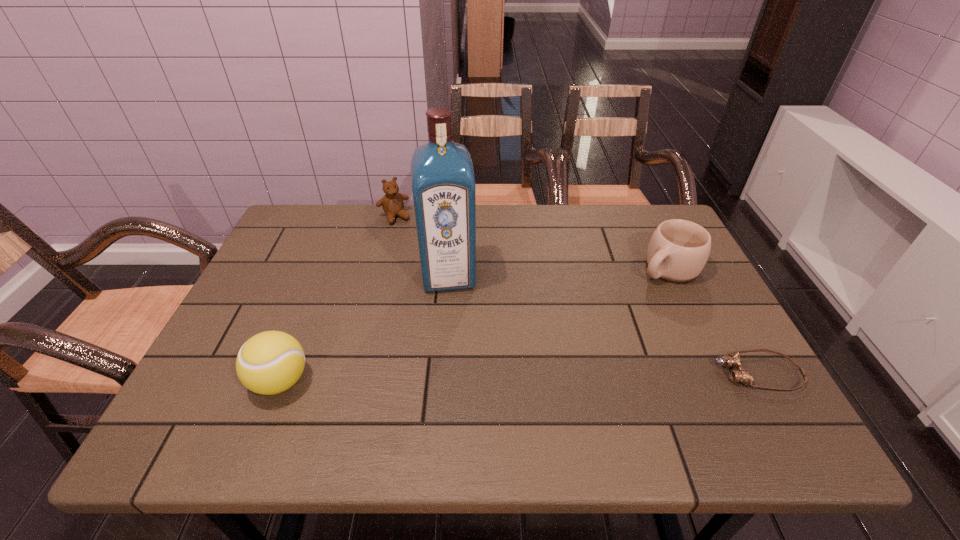
What are the coordinates of `vacant area between the shortest object and the mug` in the screenshot? It's located at (712, 321).

Where is `empty space that is in between the leftmost object and the mug`? empty space that is in between the leftmost object and the mug is located at coordinates (474, 325).

At what (x,y) coordinates should I click in order to perform the action: click on unoccupied position between the leftmost object and the tallest object. Please return your answer as a coordinate pair (x, y). The width and height of the screenshot is (960, 540). Looking at the image, I should click on (365, 328).

What are the coordinates of `the second closest object to the mug` in the screenshot? It's located at (443, 181).

You are a GUI agent. You are given a task and a screenshot of the screen. Output one action in this format:
    pyautogui.click(x=<x>, y=<y>)
    Task: Click on the fourth closest object to the second object from left to right
    Image resolution: width=960 pixels, height=540 pixels.
    Given the screenshot: What is the action you would take?
    pyautogui.click(x=740, y=375)

Locate an element on the screen. vacant space that satisfies the following two spatial constraints: 1. on the front side of the shortest object; 2. on the front lenses and sides of the liquor is located at coordinates (441, 373).

Find the location of `free spot that satisfies the following two spatial constraints: 1. on the front side of the mug; 2. on the left side of the teddy bear`. free spot that satisfies the following two spatial constraints: 1. on the front side of the mug; 2. on the left side of the teddy bear is located at coordinates (381, 268).

The height and width of the screenshot is (540, 960). In order to click on free space in the image that satisfies the following two spatial constraints: 1. on the back side of the third object from left to right; 2. on the left side of the mug in this screenshot , I will do coord(449,268).

Identify the location of free spot that satisfies the following two spatial constraints: 1. on the front side of the fourth object from right to left; 2. on the left side of the liquor. (379, 275).

Locate an element on the screen. blank area in the image that satisfies the following two spatial constraints: 1. on the front side of the teddy bear; 2. on the left side of the third object from left to right is located at coordinates (379, 275).